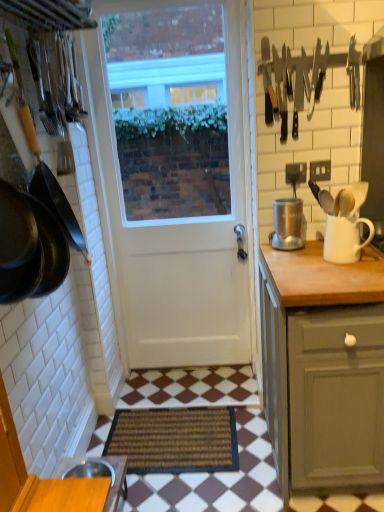
Where is `free space above brown woven mat at center (from a real-world perspective)`? free space above brown woven mat at center (from a real-world perspective) is located at coordinates (191, 425).